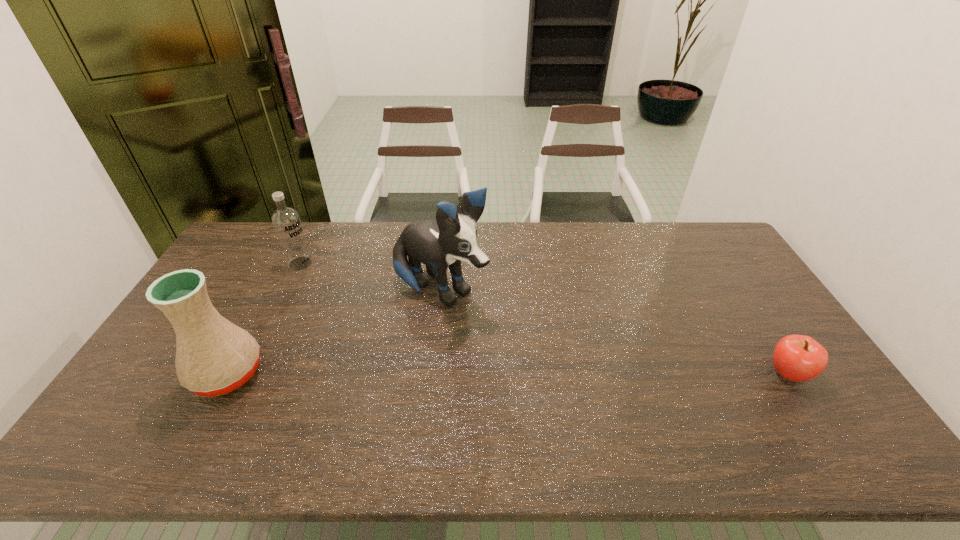
Locate an element on the screen. The height and width of the screenshot is (540, 960). free space that is in between the vodka and the puppy is located at coordinates (371, 277).

Locate an element on the screen. Image resolution: width=960 pixels, height=540 pixels. vacant point located between the puppy and the pottery is located at coordinates (334, 332).

Locate an element on the screen. This screenshot has width=960, height=540. unoccupied area between the second object from right to left and the vodka is located at coordinates (371, 277).

This screenshot has height=540, width=960. Identify the location of free spot between the rightmost object and the pottery. (508, 374).

Where is `empty space between the vodka and the apple`? empty space between the vodka and the apple is located at coordinates [544, 319].

The width and height of the screenshot is (960, 540). Identify the location of free space between the pottery and the vodka. (264, 319).

Where is `object that is the third nearest to the third object from left to right`? The image size is (960, 540). object that is the third nearest to the third object from left to right is located at coordinates (798, 358).

Identify which object is the third nearest to the pottery. Please provide its 2D coordinates. Your answer should be formatted as a tuple, i.e. [(x, y)], where the tuple contains the x and y coordinates of a point satisfying the conditions above.

[(798, 358)]

The image size is (960, 540). Identify the location of vacant position in the image that satisfies the following two spatial constraints: 1. on the front side of the second object from right to left; 2. on the left side of the rightmost object. (433, 374).